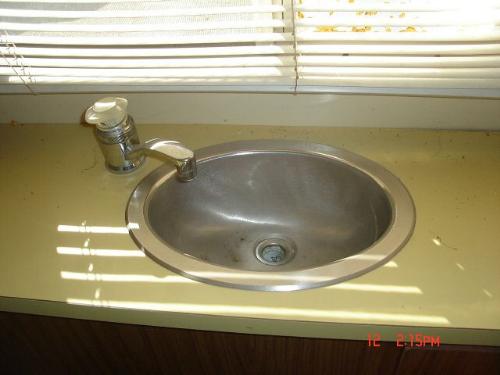
Locate an element on the screen. Image resolution: width=500 pixels, height=375 pixels. cream counter top is located at coordinates (85, 251).